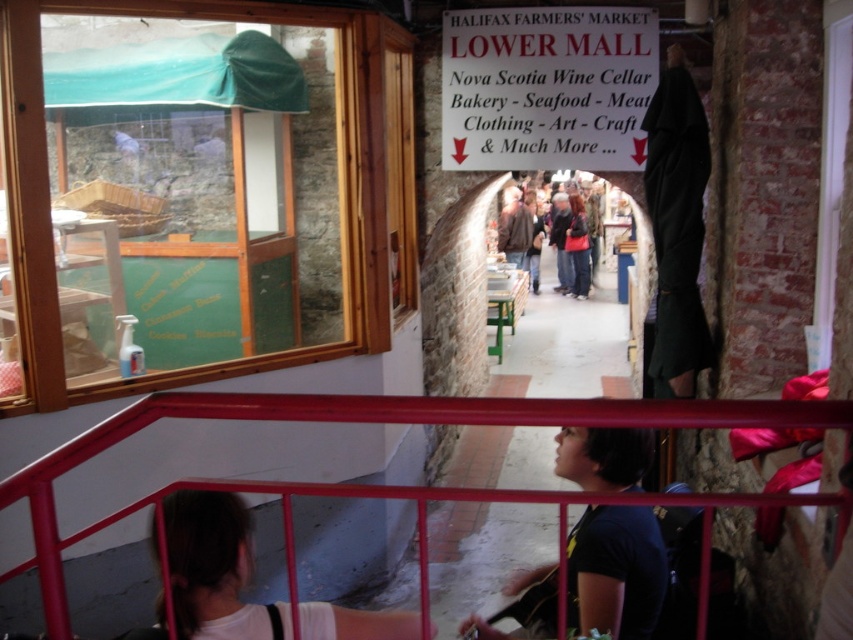
Question: Which point is farther to the camera?

Choices:
 (A) matte black jacket at center
 (B) dark blue t-shirt at lower center
 (C) dark blue jeans at center

Answer: (C)

Question: Is white matte shirt at lower left above dark blue jeans at center?

Choices:
 (A) no
 (B) yes

Answer: (A)

Question: Does white matte shirt at lower left appear on the left side of matte black jacket at center?

Choices:
 (A) yes
 (B) no

Answer: (A)

Question: Can you confirm if metallic red railing at lower center is bigger than dark blue jeans at center?

Choices:
 (A) no
 (B) yes

Answer: (A)

Question: Among these points, which one is nearest to the camera?

Choices:
 (A) (582, 234)
 (B) (575, 557)
 (C) (186, 480)
 (D) (566, 269)

Answer: (C)

Question: Among these objects, which one is farthest from the camera?

Choices:
 (A) dark blue jeans at center
 (B) white matte shirt at lower left

Answer: (A)